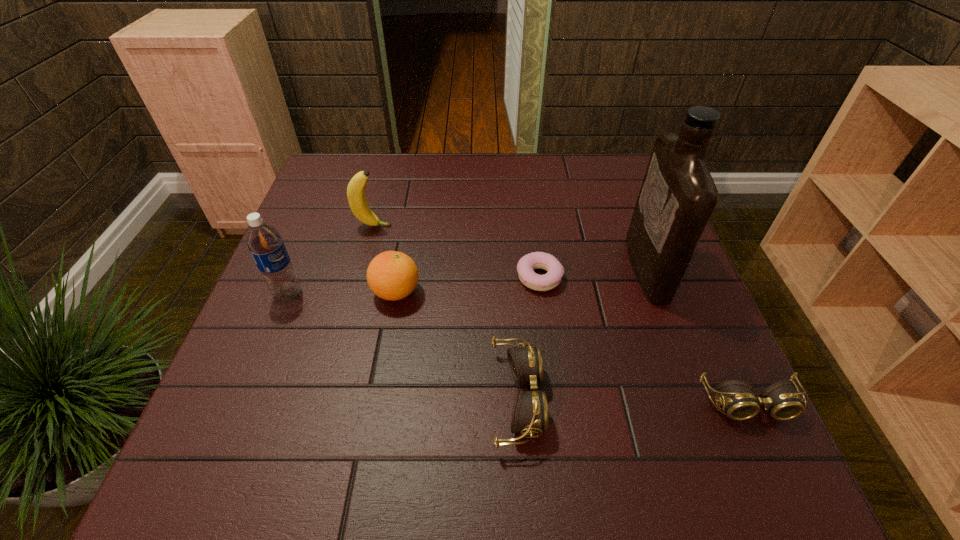
Where is `water bottle that is at the left edge`? water bottle that is at the left edge is located at coordinates (264, 242).

I want to click on goggles at the right edge, so click(781, 400).

At what (x,y) coordinates should I click in order to perform the action: click on liquor that is at the right edge. Please return your answer as a coordinate pair (x, y). The image size is (960, 540). Looking at the image, I should click on (678, 195).

At what (x,y) coordinates should I click in order to perform the action: click on object at the near right corner. Please return your answer as a coordinate pair (x, y). Looking at the image, I should click on (781, 400).

The image size is (960, 540). In order to click on free location at the far edge in this screenshot , I will do `click(428, 172)`.

The image size is (960, 540). I want to click on vacant space at the near edge of the desktop, so click(304, 407).

In the image, there is a desktop. What are the coordinates of `vacant area at the left edge` in the screenshot? It's located at (305, 328).

Where is `vacant space at the right edge`? vacant space at the right edge is located at coordinates (662, 323).

At what (x,y) coordinates should I click in order to perform the action: click on vacant area at the far left corner. Please return your answer as a coordinate pair (x, y). The width and height of the screenshot is (960, 540). Looking at the image, I should click on (325, 161).

Locate an element on the screen. vacant area between the doughnut and the third tallest object is located at coordinates (456, 252).